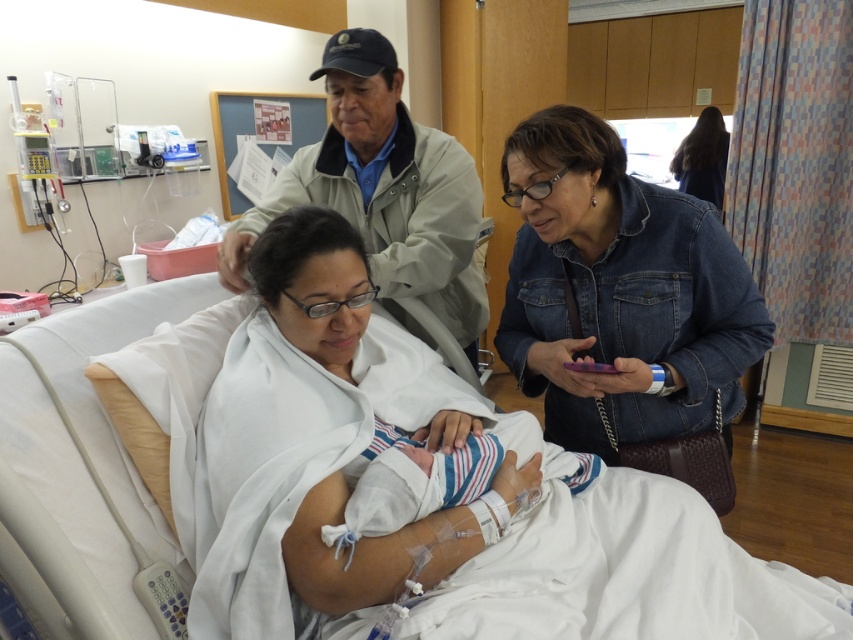
Can you confirm if khaki jacket at upper center is positioned above striped fabric swaddle at center?

Yes.

Find the location of a particular element. khaki jacket at upper center is located at coordinates (386, 198).

I want to click on khaki jacket at upper center, so click(386, 198).

Between white fabric hospital bed at center and dark brown hair at upper right, which one is positioned lower?

white fabric hospital bed at center

Is white fabric hospital bed at center further to the viewer compared to dark brown hair at upper right?

No, white fabric hospital bed at center is closer to the viewer.

Between point (138, 355) and point (718, 168), which one is positioned behind?

Positioned behind is point (718, 168).

Find the location of a particular element. The image size is (853, 640). white fabric hospital bed at center is located at coordinates (625, 573).

Does denim jacket at right have a greater height compared to khaki jacket at upper center?

Incorrect, denim jacket at right's height is not larger of khaki jacket at upper center's.

Can you confirm if denim jacket at right is bigger than khaki jacket at upper center?

Actually, denim jacket at right might be smaller than khaki jacket at upper center.

Does point (723, 246) come closer to viewer compared to point (335, 198)?

Yes, point (723, 246) is in front of point (335, 198).

Locate an element on the screen. This screenshot has height=640, width=853. denim jacket at right is located at coordinates coord(624,305).